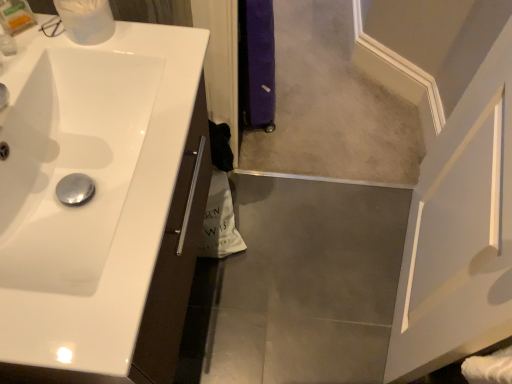
What are the coordinates of `beige carpet at center` in the screenshot? It's located at (334, 104).

Considering the relative sizes of beige carpet at center and white glossy sink at left in the image provided, is beige carpet at center wider than white glossy sink at left?

Yes.

Can you confirm if beige carpet at center is bigger than white glossy sink at left?

No.

Which object is closer to the camera, beige carpet at center or white glossy sink at left?

white glossy sink at left is more forward.

Is beige carpet at center not close to white glossy sink at left?

Yes.

From the image's perspective, does translucent plastic container at upper left appear higher than beige carpet at center?

No, from the image's perspective, translucent plastic container at upper left is not on top of beige carpet at center.

Who is shorter, translucent plastic container at upper left or beige carpet at center?

Standing shorter between the two is beige carpet at center.

Measure the distance between translucent plastic container at upper left and beige carpet at center.

translucent plastic container at upper left and beige carpet at center are 1.34 meters apart from each other.

Is translucent plastic container at upper left oriented towards beige carpet at center?

Answer: No, translucent plastic container at upper left is not facing towards beige carpet at center.

Considering the sizes of objects translucent plastic container at upper left and white glossy sink at left in the image provided, who is bigger, translucent plastic container at upper left or white glossy sink at left?

white glossy sink at left.

Between translucent plastic container at upper left and white glossy sink at left, which one has smaller width?

translucent plastic container at upper left is thinner.

From the image's perspective, which is below, translucent plastic container at upper left or white glossy sink at left?

white glossy sink at left appears lower in the image.

Is translucent plastic container at upper left situated inside white glossy sink at left or outside?

translucent plastic container at upper left is enclosed within white glossy sink at left.

Which is in front, point (138, 265) or point (293, 72)?

Point (138, 265)

Between white glossy sink at left and beige carpet at center, which one appears on the right side from the viewer's perspective?

beige carpet at center.

Would you say white glossy sink at left is a long distance from beige carpet at center?

That's right, there is a large distance between white glossy sink at left and beige carpet at center.

Is white glossy sink at left located outside beige carpet at center?

Yes.

Which of these two, beige carpet at center or translucent plastic container at upper left, is smaller?

translucent plastic container at upper left is smaller.

Is beige carpet at center with translucent plastic container at upper left?

They are not placed beside each other.

Looking at this image, is beige carpet at center inside the boundaries of translucent plastic container at upper left, or outside?

beige carpet at center is outside translucent plastic container at upper left.

From a real-world perspective, is beige carpet at center on translucent plastic container at upper left?

No, from a real-world perspective, beige carpet at center is not above translucent plastic container at upper left.

Is white glossy sink at left in front of or behind translucent plastic container at upper left in the image?

Clearly, white glossy sink at left is in front of translucent plastic container at upper left.

Is white glossy sink at left positioned with its back to translucent plastic container at upper left?

That's not correct — white glossy sink at left is not looking away from translucent plastic container at upper left.

In the image, is white glossy sink at left on the left side or the right side of translucent plastic container at upper left?

From the image, it's evident that white glossy sink at left is to the right of translucent plastic container at upper left.

Who is taller, white glossy sink at left or translucent plastic container at upper left?

Standing taller between the two is white glossy sink at left.

The height and width of the screenshot is (384, 512). I want to click on mirror that is above the white glossy sink at left (from the image's perspective), so click(334, 104).

The height and width of the screenshot is (384, 512). Identify the location of mirror below the translucent plastic container at upper left (from a real-world perspective). (334, 104).

Looking at the image, which one is located further to translucent plastic container at upper left, beige carpet at center or white glossy sink at left?

beige carpet at center is positioned further to the anchor translucent plastic container at upper left.

Based on the photo, considering their positions, is white glossy sink at left positioned further to beige carpet at center than translucent plastic container at upper left?

translucent plastic container at upper left is positioned further to the anchor beige carpet at center.

From the image, which object appears to be nearer to white glossy sink at left, beige carpet at center or translucent plastic container at upper left?

translucent plastic container at upper left lies closer to white glossy sink at left than the other object.

Estimate the real-world distances between objects in this image. Which object is closer to beige carpet at center, translucent plastic container at upper left or white glossy sink at left?

The object closer to beige carpet at center is white glossy sink at left.

When comparing their distances from translucent plastic container at upper left, does white glossy sink at left or beige carpet at center seem closer?

Among the two, white glossy sink at left is located nearer to translucent plastic container at upper left.

From the image, which object appears to be nearer to white glossy sink at left, translucent plastic container at upper left or beige carpet at center?

translucent plastic container at upper left lies closer to white glossy sink at left than the other object.

You are a GUI agent. You are given a task and a screenshot of the screen. Output one action in this format:
    pyautogui.click(x=<x>, y=<y>)
    Task: Click on the toiletry positioned between white glossy sink at left and beige carpet at center from near to far
    The height and width of the screenshot is (384, 512).
    Given the screenshot: What is the action you would take?
    pyautogui.click(x=16, y=16)